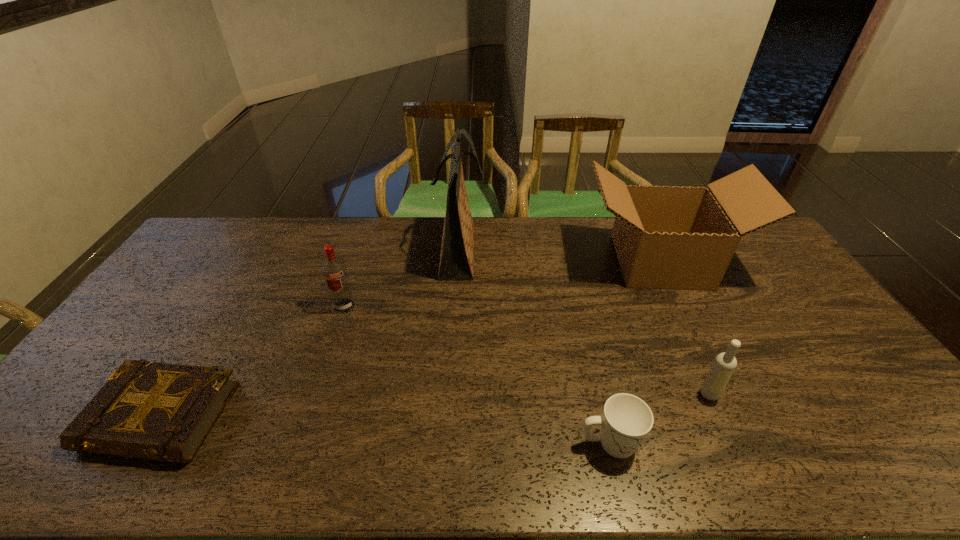
Where is `vacant area situated 0.200m on the front-facing side of the third object from left to right`? vacant area situated 0.200m on the front-facing side of the third object from left to right is located at coordinates (539, 252).

The height and width of the screenshot is (540, 960). I want to click on free space located on the back of the fifth shortest object, so click(x=640, y=222).

Image resolution: width=960 pixels, height=540 pixels. I want to click on vacant space located 0.250m on the front label of the left vodka, so click(x=320, y=382).

The image size is (960, 540). Identify the location of vacant space located on the front of the third shortest object. (722, 423).

This screenshot has width=960, height=540. Find the location of `blank space located on the side of the mug with the handle`. blank space located on the side of the mug with the handle is located at coordinates (796, 443).

Locate an element on the screen. This screenshot has height=540, width=960. blank space located on the right of the shortest object is located at coordinates (353, 417).

Find the location of a particular element. The width and height of the screenshot is (960, 540). shopping bag that is at the far edge is located at coordinates (457, 249).

This screenshot has width=960, height=540. I want to click on box that is positioned at the far edge, so click(x=666, y=237).

This screenshot has width=960, height=540. Find the location of `mug that is at the near edge`. mug that is at the near edge is located at coordinates (626, 421).

At what (x,y) coordinates should I click in order to perform the action: click on hardback book that is at the near edge. Please return your answer as a coordinate pair (x, y). This screenshot has height=540, width=960. Looking at the image, I should click on (155, 411).